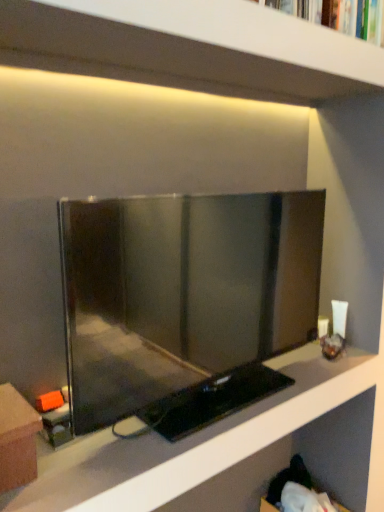
The height and width of the screenshot is (512, 384). In order to click on free space above matte black tv at center, which is the 2th shelf in top-to-bottom order (from a real-world perspective) in this screenshot , I will do [216, 408].